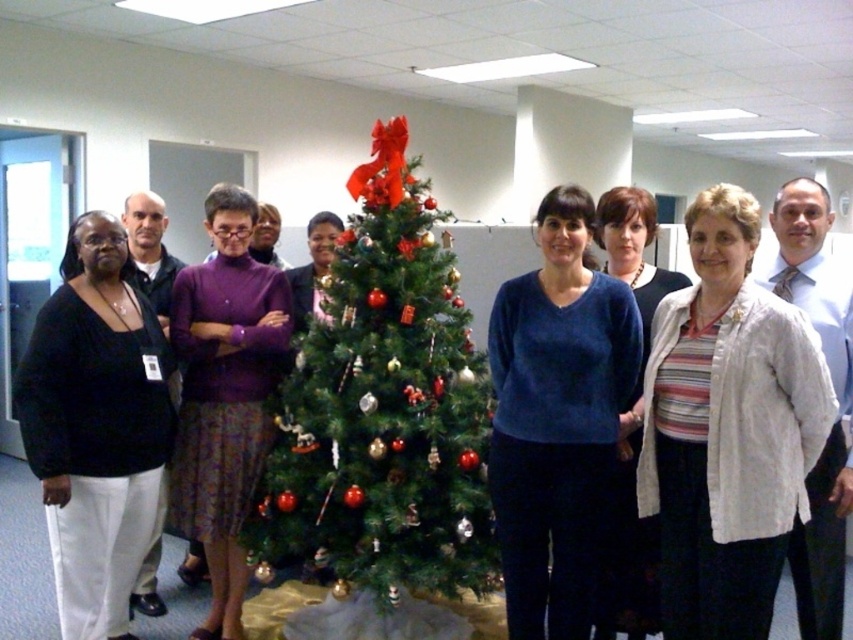
This screenshot has width=853, height=640. What are the coordinates of `striped knit shirt at center` in the screenshot? It's located at (728, 429).

Between striped knit shirt at center and black matte sweater at left, which one has more height?

With more height is black matte sweater at left.

The height and width of the screenshot is (640, 853). Describe the element at coordinates (728, 429) in the screenshot. I see `striped knit shirt at center` at that location.

Image resolution: width=853 pixels, height=640 pixels. In order to click on striped knit shirt at center in this screenshot , I will do `click(728, 429)`.

Which is more to the right, striped knit sweater at center or purple sweater at center?

striped knit sweater at center

At what (x,y) coordinates should I click in order to perform the action: click on striped knit sweater at center. Please return your answer as a coordinate pair (x, y). Image resolution: width=853 pixels, height=640 pixels. Looking at the image, I should click on (630, 422).

Does point (647, 582) come behind point (299, 289)?

No, it is in front of (299, 289).

Locate an element on the screen. The height and width of the screenshot is (640, 853). striped knit sweater at center is located at coordinates (630, 422).

Is green textured christmas tree at center to the left of purple fabric skirt at center from the viewer's perspective?

In fact, green textured christmas tree at center is to the right of purple fabric skirt at center.

Does point (367, 236) lie behind point (228, 301)?

No.

Between point (393, 296) and point (258, 332), which one is positioned behind?

Point (258, 332)

At what (x,y) coordinates should I click in order to perform the action: click on green textured christmas tree at center. Please return your answer as a coordinate pair (x, y). Looking at the image, I should click on (384, 406).